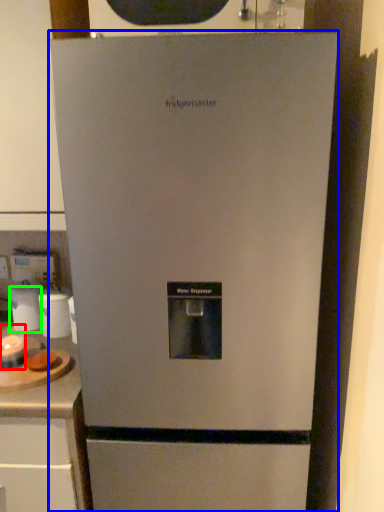
Question: Which object is positioned closest to appliance (highlighted by a red box)? Select from refrigerator (highlighted by a blue box) and appliance (highlighted by a green box).

Choices:
 (A) refrigerator
 (B) appliance

Answer: (B)